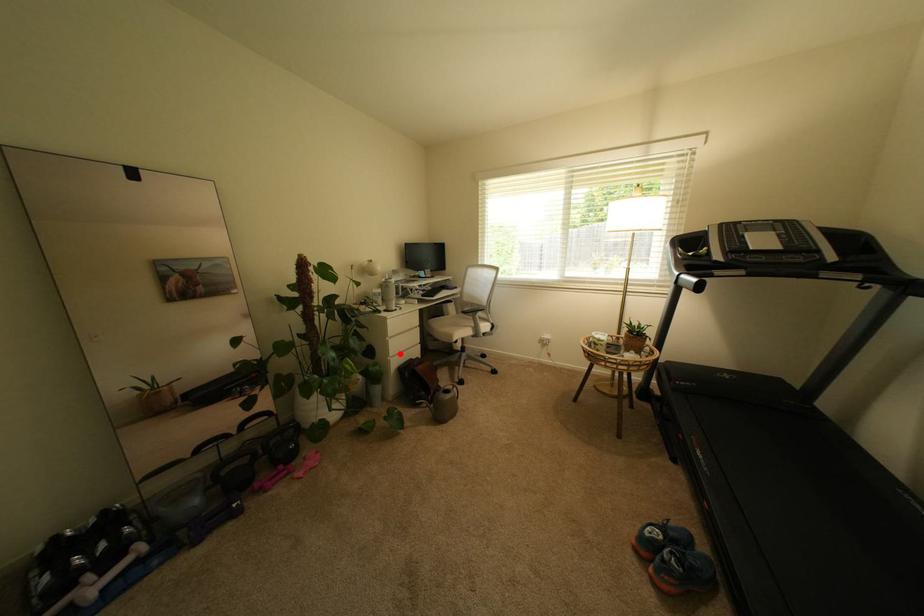
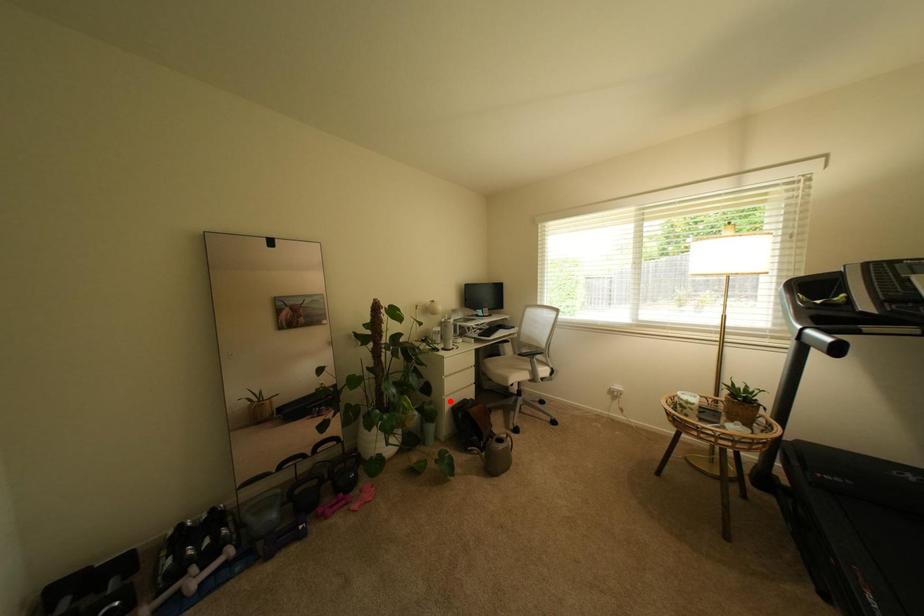
I am providing you with two images of the same scene from different viewpoints. A red point is marked on the first image and another point is marked on the second image. Is the marked point in image1 the same physical position as the marked point in image2?

No